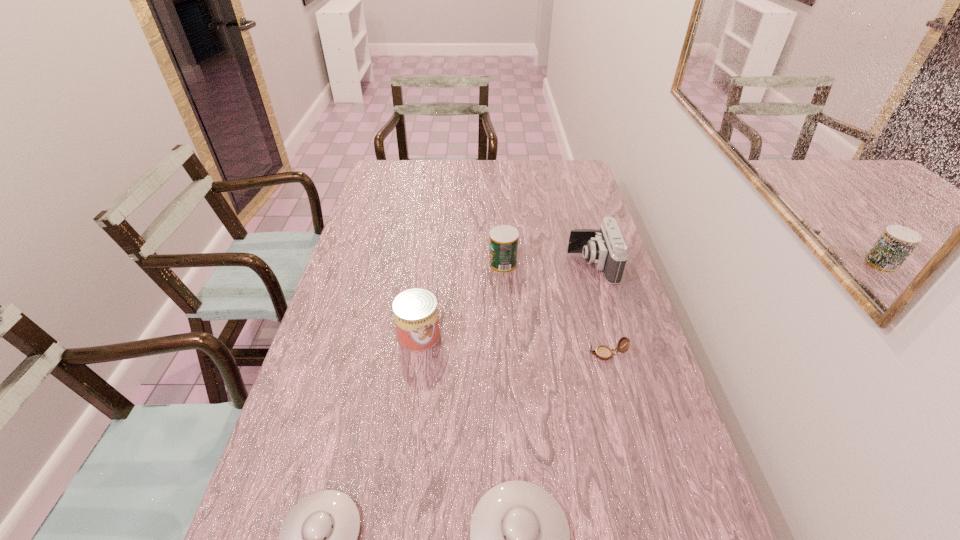
Please point a free position for a saucer on the right. Please provide its 2D coordinates. Your answer should be formatted as a tuple, i.e. [(x, y)], where the tuple contains the x and y coordinates of a point satisfying the conditions above.

[(717, 537)]